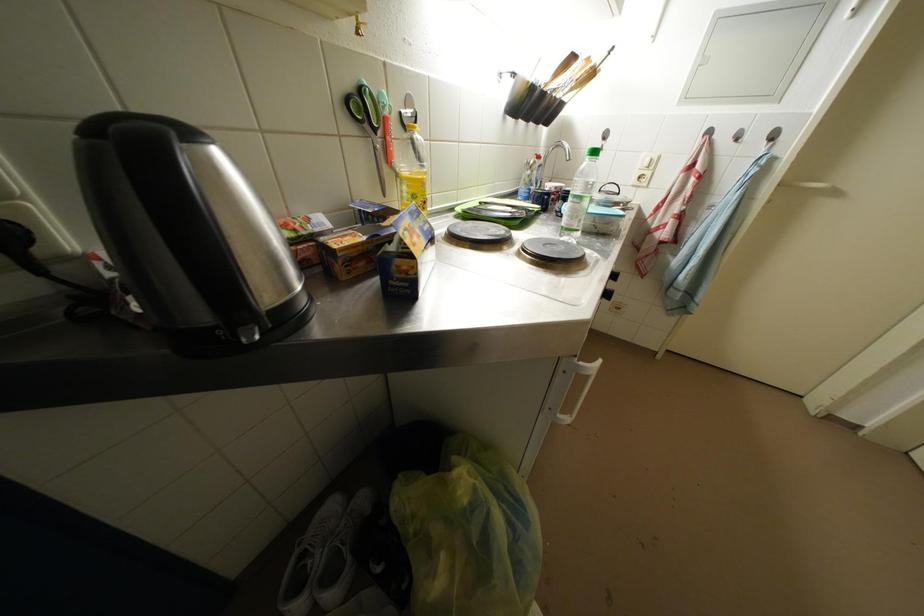
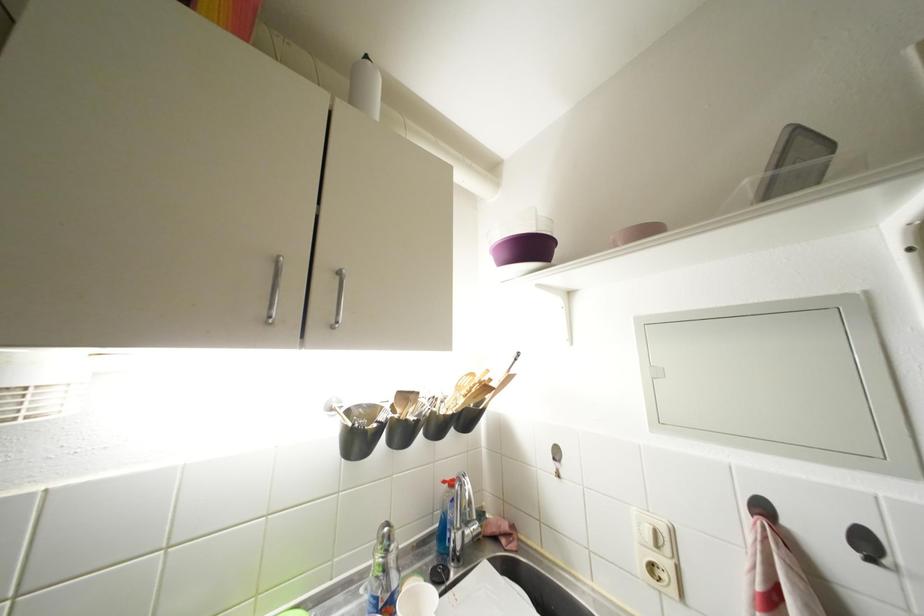
Where in the second image is the point corresponding to the point at 596,63 from the first image?

(479, 379)